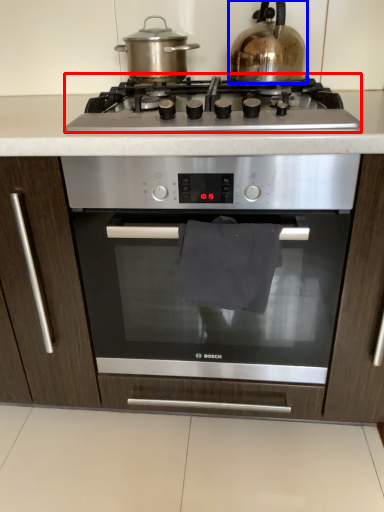
Question: Among these objects, which one is nearest to the camera, gas stove (highlighted by a red box) or kitchen appliance (highlighted by a blue box)?

Choices:
 (A) gas stove
 (B) kitchen appliance

Answer: (A)